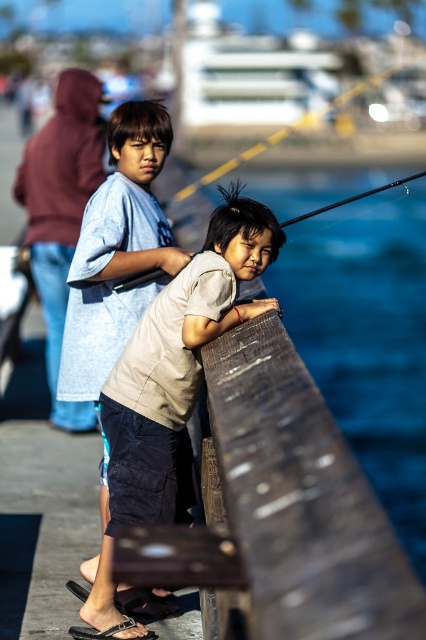
Question: Is beige cotton shirt at center above black glossy fishing pole at upper right?

Choices:
 (A) yes
 (B) no

Answer: (B)

Question: Which is farther from the light blue cotton shirt at center?

Choices:
 (A) black glossy fishing pole at upper right
 (B) beige cotton shirt at center

Answer: (A)

Question: Can you confirm if beige cotton shirt at center is wider than black glossy fishing pole at upper right?

Choices:
 (A) yes
 (B) no

Answer: (B)

Question: Does light blue cotton shirt at center have a lesser width compared to black glossy fishing pole at upper right?

Choices:
 (A) no
 (B) yes

Answer: (B)

Question: Among these objects, which one is nearest to the camera?

Choices:
 (A) matte black fishing pole at upper center
 (B) beige cotton shirt at center

Answer: (B)

Question: Which of the following is the closest to the observer?

Choices:
 (A) beige cotton shirt at center
 (B) light blue cotton shirt at center

Answer: (A)